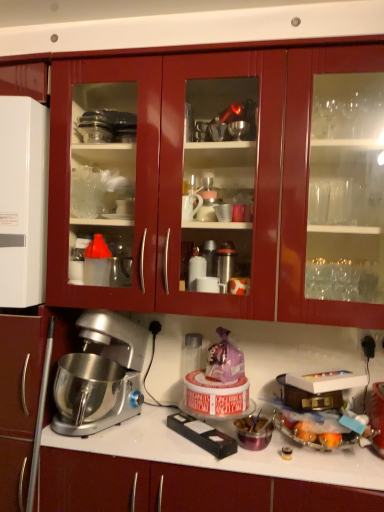
Question: From a real-world perspective, is satin silver countertop at center positioned above or below silver metallic mixer at lower left?

Choices:
 (A) below
 (B) above

Answer: (A)

Question: Is satin silver countertop at center bigger or smaller than silver metallic mixer at lower left?

Choices:
 (A) small
 (B) big

Answer: (B)

Question: Estimate the real-world distances between objects in this image. Which object is farther from the white glossy refrigerator at left, which appears as the first appliance when viewed from the top?

Choices:
 (A) satin silver countertop at center
 (B) silver metallic mixer at lower left
 (C) black plastic electrical outlet at upper right
 (D) glossy wood cabinets at upper center
 (E) translucent plastic container at lower right, the 1th appliance positioned from the bottom

Answer: (C)

Question: Which is nearer to the black plastic electrical outlet at upper right?

Choices:
 (A) white glossy refrigerator at left, which is the 2th appliance from bottom to top
 (B) silver metallic mixer at lower left
 (C) glossy wood cabinets at upper center
 (D) translucent plastic container at lower right, the second appliance in the top-to-bottom sequence
 (E) satin silver countertop at center

Answer: (D)